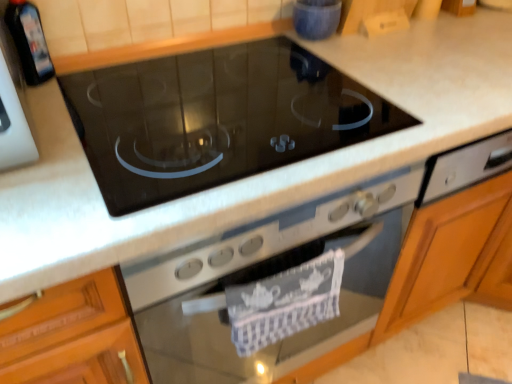
The height and width of the screenshot is (384, 512). Describe the element at coordinates (316, 18) in the screenshot. I see `blue glossy bowl at upper center, which ranks as the 2th appliance in front-to-back order` at that location.

This screenshot has height=384, width=512. What do you see at coordinates (29, 41) in the screenshot? I see `black glass bottle at upper left, the first appliance viewed from the front` at bounding box center [29, 41].

Measure the distance between point [82,130] and camera.

30.31 inches.

The height and width of the screenshot is (384, 512). Identify the location of blue glossy bowl at upper center, positioned as the first appliance in back-to-front order. [x=316, y=18].

Which is closer to the camera, (106,70) or (22,25)?

Point (106,70) appears to be farther away from the viewer than point (22,25).

From the image's perspective, between black glass cooktop at center and black glass bottle at upper left, the first appliance from the left, which one is located above?

black glass bottle at upper left, the first appliance from the left, is shown above in the image.

Where is `appliance located on the left of black glass cooktop at center`? The width and height of the screenshot is (512, 384). appliance located on the left of black glass cooktop at center is located at coordinates (29, 41).

What's the angular difference between black glass cooktop at center and black glass bottle at upper left, positioned as the 2th appliance in back-to-front order,'s facing directions?

0.637 degrees.

Is black glass bottle at upper left, the first appliance viewed from the front, positioned before blue glossy bowl at upper center, positioned as the first appliance in back-to-front order?

Yes, the depth of black glass bottle at upper left, the first appliance viewed from the front, is less than that of blue glossy bowl at upper center, positioned as the first appliance in back-to-front order.

From the image's perspective, is black glass bottle at upper left, which is the 2th appliance from right to left, below blue glossy bowl at upper center, acting as the 2th appliance starting from the left?

Indeed, from the image's perspective, black glass bottle at upper left, which is the 2th appliance from right to left, is shown beneath blue glossy bowl at upper center, acting as the 2th appliance starting from the left.

Which is closer to the camera, (25, 55) or (300, 8)?

Point (25, 55).

Can you confirm if black glass bottle at upper left, positioned as the 2th appliance in back-to-front order, is positioned to the right of blue glossy bowl at upper center, acting as the 2th appliance starting from the left?

Incorrect, black glass bottle at upper left, positioned as the 2th appliance in back-to-front order, is not on the right side of blue glossy bowl at upper center, acting as the 2th appliance starting from the left.

Is black glass cooktop at center directly adjacent to blue glossy bowl at upper center, acting as the 2th appliance starting from the left?

No, black glass cooktop at center is not with blue glossy bowl at upper center, acting as the 2th appliance starting from the left.

Considering the positions of objects black glass cooktop at center and blue glossy bowl at upper center, which ranks as the 2th appliance in front-to-back order, in the image provided, who is more to the left, black glass cooktop at center or blue glossy bowl at upper center, which ranks as the 2th appliance in front-to-back order,?

black glass cooktop at center.

Identify the location of appliance that appears on the right of black glass cooktop at center. This screenshot has height=384, width=512. (316, 18).

Considering the positions of objects black glass cooktop at center and blue glossy bowl at upper center, positioned as the first appliance in right-to-left order, in the image provided, who is behind, black glass cooktop at center or blue glossy bowl at upper center, positioned as the first appliance in right-to-left order,?

Positioned behind is blue glossy bowl at upper center, positioned as the first appliance in right-to-left order.

From a real-world perspective, is black glass cooktop at center located beneath blue glossy bowl at upper center, positioned as the first appliance in right-to-left order?

Yes, from a real-world perspective, black glass cooktop at center is below blue glossy bowl at upper center, positioned as the first appliance in right-to-left order.

Which is more distant, (x=234, y=271) or (x=301, y=4)?

The point (x=301, y=4) is farther from the camera.

Is black glass bottle at upper left, the first appliance viewed from the front, at the left side of black glass cooktop at center?

Yes, black glass bottle at upper left, the first appliance viewed from the front, is to the left of black glass cooktop at center.

Would you say black glass bottle at upper left, which is the 2th appliance from right to left, contains black glass cooktop at center?

Definitely not — black glass cooktop at center is not inside black glass bottle at upper left, which is the 2th appliance from right to left.

Identify the location of the 1st appliance behind the black glass cooktop at center. (x=29, y=41).

Is black glass bottle at upper left, positioned as the 2th appliance in back-to-front order, aimed at black glass cooktop at center?

No, black glass bottle at upper left, positioned as the 2th appliance in back-to-front order, does not turn towards black glass cooktop at center.

From a real-world perspective, who is located lower, blue glossy bowl at upper center, which ranks as the 2th appliance in front-to-back order, or black glass cooktop at center?

In real-world perspective, black glass cooktop at center is lower.

Who is shorter, blue glossy bowl at upper center, which ranks as the 2th appliance in front-to-back order, or black glass cooktop at center?

Standing shorter between the two is black glass cooktop at center.

Can black glass cooktop at center be found inside blue glossy bowl at upper center, positioned as the first appliance in back-to-front order?

No, black glass cooktop at center is not inside blue glossy bowl at upper center, positioned as the first appliance in back-to-front order.

From the image's perspective, which object appears higher, blue glossy bowl at upper center, positioned as the first appliance in back-to-front order, or black glass cooktop at center?

blue glossy bowl at upper center, positioned as the first appliance in back-to-front order, appears higher in the image.

Does black glass cooktop at center come behind black glass cooktop at center?

No, black glass cooktop at center is closer to the camera.

Who is smaller, black glass cooktop at center or black glass cooktop at center?

black glass cooktop at center.

From the image's perspective, between black glass cooktop at center and black glass cooktop at center, which one is located above?

black glass cooktop at center appears higher in the image.

Is black glass cooktop at center positioned far away from black glass cooktop at center?

black glass cooktop at center is near black glass cooktop at center, not far away.

The height and width of the screenshot is (384, 512). I want to click on gas stove in front of the black glass bottle at upper left, the first appliance viewed from the front, so click(215, 118).

Find the location of a particular element. The height and width of the screenshot is (384, 512). appliance above the blue glossy bowl at upper center, positioned as the first appliance in back-to-front order (from a real-world perspective) is located at coordinates pos(29,41).

From the picture: Based on their spatial positions, is blue glossy bowl at upper center, positioned as the first appliance in back-to-front order, or black glass cooktop at center further from black glass bottle at upper left, the first appliance from the left?

black glass cooktop at center is positioned further to the anchor black glass bottle at upper left, the first appliance from the left.

Considering their positions, is black glass cooktop at center positioned further to blue glossy bowl at upper center, acting as the 2th appliance starting from the left, than black glass bottle at upper left, which is the 2th appliance from right to left?

The object further to blue glossy bowl at upper center, acting as the 2th appliance starting from the left, is black glass cooktop at center.

When comparing their distances from blue glossy bowl at upper center, acting as the 2th appliance starting from the left, does black glass bottle at upper left, the first appliance from the left, or black glass cooktop at center seem further?

Based on the image, black glass bottle at upper left, the first appliance from the left, appears to be further to blue glossy bowl at upper center, acting as the 2th appliance starting from the left.

Estimate the real-world distances between objects in this image. Which object is further from blue glossy bowl at upper center, positioned as the first appliance in back-to-front order, black glass cooktop at center or black glass cooktop at center?

Among the two, black glass cooktop at center is located further to blue glossy bowl at upper center, positioned as the first appliance in back-to-front order.

Estimate the real-world distances between objects in this image. Which object is closer to blue glossy bowl at upper center, positioned as the first appliance in back-to-front order, black glass bottle at upper left, which is the 2th appliance from right to left, or black glass cooktop at center?

black glass bottle at upper left, which is the 2th appliance from right to left, is closer to blue glossy bowl at upper center, positioned as the first appliance in back-to-front order.

Based on their spatial positions, is black glass cooktop at center or black glass bottle at upper left, the first appliance viewed from the front, further from blue glossy bowl at upper center, positioned as the first appliance in back-to-front order?

Based on the image, black glass bottle at upper left, the first appliance viewed from the front, appears to be further to blue glossy bowl at upper center, positioned as the first appliance in back-to-front order.

From the image, which object appears to be farther from black glass bottle at upper left, which is the 2th appliance from right to left, blue glossy bowl at upper center, acting as the 2th appliance starting from the left, or black glass cooktop at center?

blue glossy bowl at upper center, acting as the 2th appliance starting from the left, is positioned further to the anchor black glass bottle at upper left, which is the 2th appliance from right to left.

Considering their positions, is black glass cooktop at center positioned closer to black glass cooktop at center than blue glossy bowl at upper center, acting as the 2th appliance starting from the left?

black glass cooktop at center is positioned closer to the anchor black glass cooktop at center.

The width and height of the screenshot is (512, 384). I want to click on gas stove between black glass bottle at upper left, which is the 2th appliance from right to left, and black glass cooktop at center vertically, so click(x=215, y=118).

This screenshot has height=384, width=512. I want to click on appliance that lies between blue glossy bowl at upper center, positioned as the first appliance in back-to-front order, and black glass cooktop at center from top to bottom, so click(29, 41).

Image resolution: width=512 pixels, height=384 pixels. What are the coordinates of `gas stove between black glass bottle at upper left, positioned as the 2th appliance in back-to-front order, and blue glossy bowl at upper center, positioned as the first appliance in back-to-front order, in the horizontal direction` in the screenshot? It's located at (215, 118).

This screenshot has height=384, width=512. I want to click on gas stove between blue glossy bowl at upper center, which ranks as the 2th appliance in front-to-back order, and black glass cooktop at center vertically, so click(215, 118).